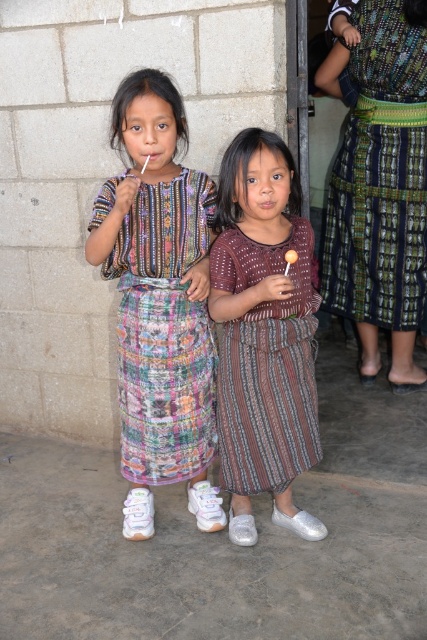
Question: Among these objects, which one is nearest to the camera?

Choices:
 (A) multicolored woven dress at center
 (B) brown striped dress at center
 (C) green and blue woven skirt at right

Answer: (B)

Question: Which point appears farthest from the camera in this image?

Choices:
 (A) (157, 353)
 (B) (234, 403)
 (C) (350, 188)

Answer: (C)

Question: Is green and blue woven skirt at right to the left of brown striped dress at center from the viewer's perspective?

Choices:
 (A) no
 (B) yes

Answer: (A)

Question: Is green and blue woven skirt at right to the left of multicolored woven dress at center from the viewer's perspective?

Choices:
 (A) no
 (B) yes

Answer: (A)

Question: Which point is closer to the camera?

Choices:
 (A) 183,170
 (B) 315,385
 (C) 363,90

Answer: (A)

Question: Can you confirm if green and blue woven skirt at right is thinner than multicolored woven dress at center?

Choices:
 (A) no
 (B) yes

Answer: (A)